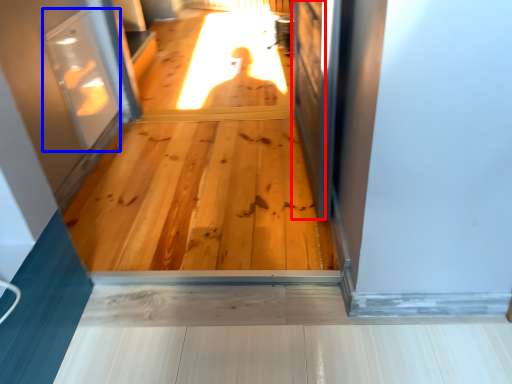
Question: Which object appears farthest to the camera in this image, screen door (highlighted by a red box) or screen door (highlighted by a blue box)?

Choices:
 (A) screen door
 (B) screen door

Answer: (B)